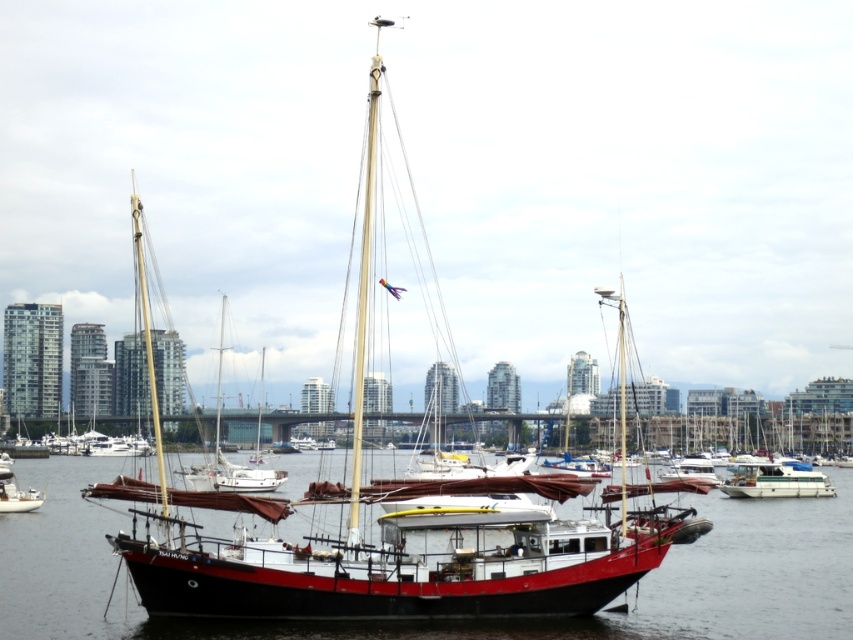
Identify the location of black matte water at center. The width and height of the screenshot is (853, 640). (460, 621).

I want to click on black matte water at center, so pyautogui.click(x=460, y=621).

Is red matte sailboat at center behind matte black sailboat at left?

That is False.

Locate an element on the screen. Image resolution: width=853 pixels, height=640 pixels. red matte sailboat at center is located at coordinates (392, 534).

What are the coordinates of `red matte sailboat at center` in the screenshot? It's located at (392, 534).

Who is more distant from viewer, (808, 593) or (753, 468)?

The point (753, 468) is behind.

Is the position of black matte water at center more distant than that of white glossy catamaran at center?

No.

Which is in front, point (805, 563) or point (778, 465)?

Point (805, 563) is in front.

This screenshot has width=853, height=640. Find the location of `black matte water at center`. black matte water at center is located at coordinates (460, 621).